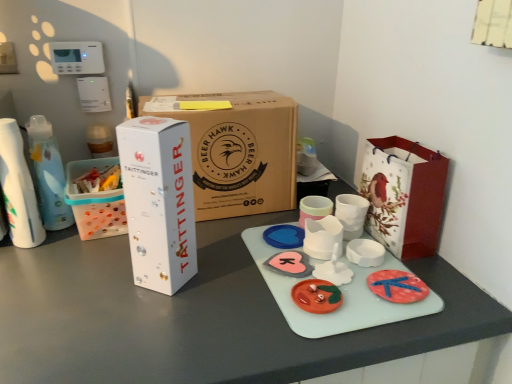
Question: Is pink matte heart at center, the 3th toy in the front-to-back sequence, wider than white paper bag with red bird design at right?

Choices:
 (A) no
 (B) yes

Answer: (A)

Question: Is the depth of pink matte heart at center, arranged as the 2th toy when viewed from the back, less than that of white paper bag with red bird design at right?

Choices:
 (A) no
 (B) yes

Answer: (A)

Question: Can you confirm if pink matte heart at center, arranged as the 2th toy when viewed from the back, is shorter than white paper bag with red bird design at right?

Choices:
 (A) no
 (B) yes

Answer: (B)

Question: Is pink matte heart at center, the 3th toy in the front-to-back sequence, further to camera compared to white paper bag with red bird design at right?

Choices:
 (A) no
 (B) yes

Answer: (B)

Question: Considering the relative positions of pink matte heart at center, arranged as the 2th toy when viewed from the back, and white paper bag with red bird design at right in the image provided, is pink matte heart at center, arranged as the 2th toy when viewed from the back, to the left of white paper bag with red bird design at right from the viewer's perspective?

Choices:
 (A) no
 (B) yes

Answer: (B)

Question: Is the surface of pink matte heart at center, arranged as the 2th toy when viewed from the back, in direct contact with white paper bag with red bird design at right?

Choices:
 (A) yes
 (B) no

Answer: (B)

Question: Considering the relative positions of matte plastic toy at center, the 4th toy from the back, and blue rubber heart at center, which appears as the fourth toy when viewed from the front, in the image provided, is matte plastic toy at center, the 4th toy from the back, behind blue rubber heart at center, which appears as the fourth toy when viewed from the front,?

Choices:
 (A) yes
 (B) no

Answer: (B)

Question: From a real-world perspective, is matte plastic toy at center, the 4th toy from the back, located beneath blue rubber heart at center, which appears as the fourth toy when viewed from the front?

Choices:
 (A) yes
 (B) no

Answer: (B)

Question: Does matte plastic toy at center, the 4th toy from the back, appear on the right side of blue rubber heart at center, the first toy from the back?

Choices:
 (A) yes
 (B) no

Answer: (A)

Question: From the image's perspective, does matte plastic toy at center, the 4th toy from the back, appear higher than blue rubber heart at center, the first toy from the back?

Choices:
 (A) no
 (B) yes

Answer: (A)

Question: From a real-world perspective, is matte plastic toy at center, the 4th toy from the back, over blue rubber heart at center, which appears as the fourth toy when viewed from the front?

Choices:
 (A) no
 (B) yes

Answer: (B)

Question: Is matte plastic toy at center, acting as the 1th toy starting from the front, shorter than blue rubber heart at center, which appears as the fourth toy when viewed from the front?

Choices:
 (A) no
 (B) yes

Answer: (A)

Question: From the image's perspective, would you say white glossy box at left, which ranks as the second box in back-to-front order, is shown under white cardboard box at left?

Choices:
 (A) no
 (B) yes

Answer: (B)